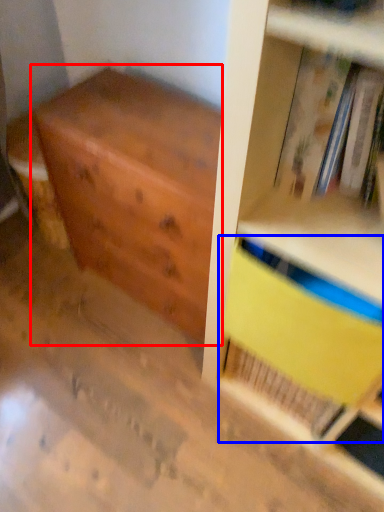
Question: Among these objects, which one is nearest to the camera, chest of drawers (highlighted by a red box) or paperback book (highlighted by a blue box)?

Choices:
 (A) chest of drawers
 (B) paperback book

Answer: (B)